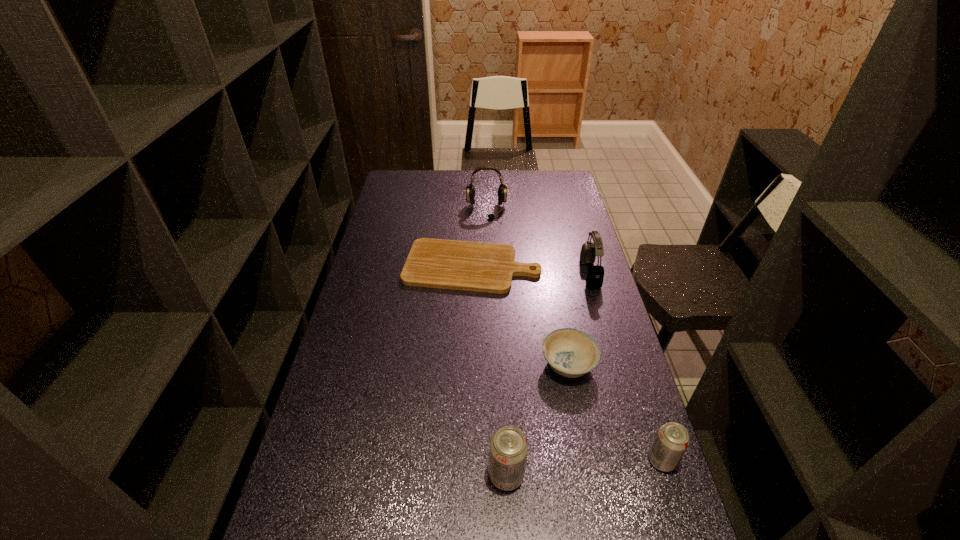
Locate an element on the screen. Image resolution: width=960 pixels, height=540 pixels. free space that satisfies the following two spatial constraints: 1. with the microphone on the side of the left soda can; 2. on the right side of the farthest object is located at coordinates (492, 475).